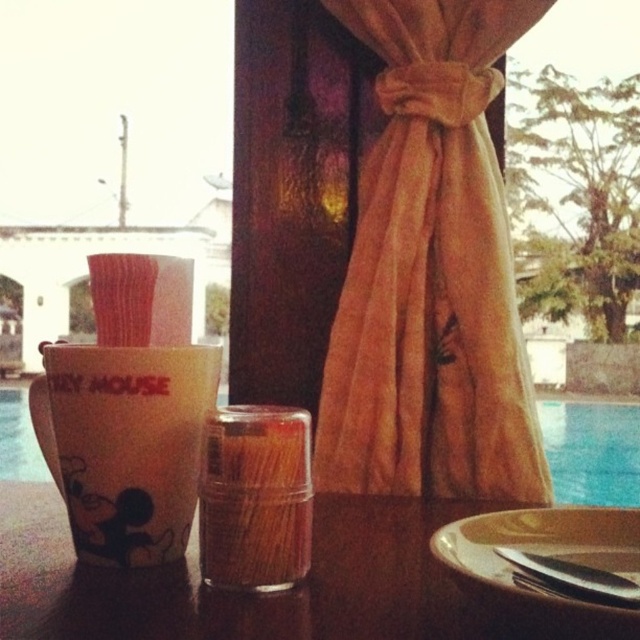
Question: Which object is positioned closest to the velvet gold curtain at center?

Choices:
 (A) brown ceramic plate at lower right
 (B) wooden table at center

Answer: (B)

Question: Which point appears closest to the camera in this image?

Choices:
 (A) (388, 81)
 (B) (417, 545)
 (C) (548, 605)

Answer: (C)

Question: Among these objects, which one is farthest from the camera?

Choices:
 (A) translucent plastic toothpicks at center
 (B) velvet gold curtain at center
 (C) white glossy cup at left
 (D) blue glass at upper right

Answer: (D)

Question: Is velvet gold curtain at center smaller than brown ceramic plate at lower right?

Choices:
 (A) no
 (B) yes

Answer: (A)

Question: Can you confirm if white glossy cup at left is wider than brown ceramic plate at lower right?

Choices:
 (A) no
 (B) yes

Answer: (A)

Question: Can you confirm if wooden table at center is smaller than blue glass at upper right?

Choices:
 (A) no
 (B) yes

Answer: (B)